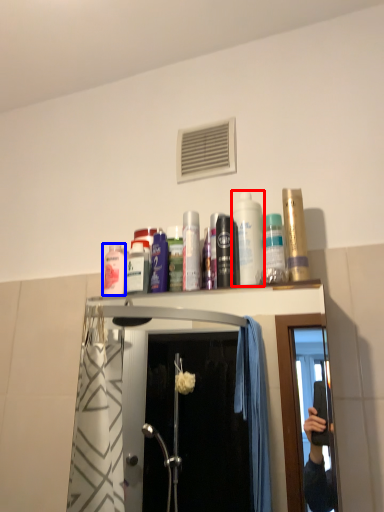
Question: Which object is further to the camera taking this photo, mouthwash (highlighted by a red box) or mouthwash (highlighted by a blue box)?

Choices:
 (A) mouthwash
 (B) mouthwash

Answer: (B)